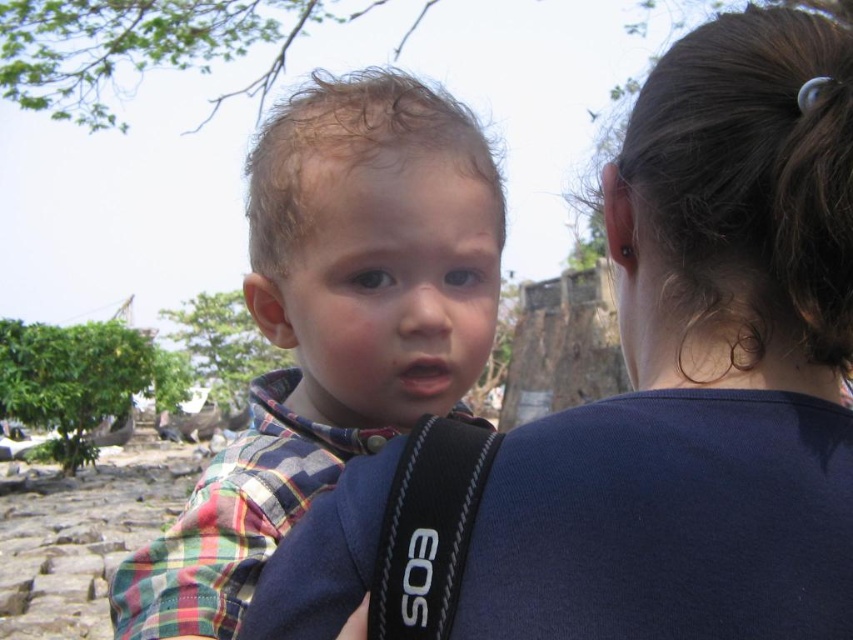
Question: Which of the following is the farthest from the observer?

Choices:
 (A) plaid shirt at center
 (B) blue fabric shirt at upper center

Answer: (B)

Question: Can you confirm if blue fabric shirt at upper center is positioned to the right of black fabric strap at center?

Choices:
 (A) no
 (B) yes

Answer: (B)

Question: Is blue fabric shirt at upper center closer to the viewer compared to plaid shirt at center?

Choices:
 (A) yes
 (B) no

Answer: (B)

Question: Which object is positioned farthest from the blue fabric shirt at upper center?

Choices:
 (A) plaid shirt at center
 (B) black fabric strap at center

Answer: (B)

Question: Can you confirm if plaid shirt at center is wider than black fabric strap at center?

Choices:
 (A) yes
 (B) no

Answer: (A)

Question: Which point is farther to the camera?

Choices:
 (A) plaid shirt at center
 (B) black fabric strap at center
 (C) blue fabric shirt at upper center

Answer: (B)